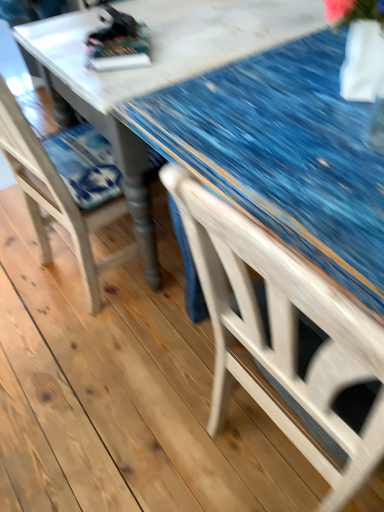
What do you see at coordinates (56, 197) in the screenshot? The height and width of the screenshot is (512, 384). I see `wooden chair at left` at bounding box center [56, 197].

Identify the location of wooden chair at left. (56, 197).

Describe the element at coordinates (283, 153) in the screenshot. The image size is (384, 512). I see `blue fabric-covered table at center` at that location.

The height and width of the screenshot is (512, 384). In order to click on blue fabric-covered table at center in this screenshot , I will do `click(283, 153)`.

In order to click on wooden chair at left in this screenshot , I will do `click(56, 197)`.

Is blue fabric-covered table at center at the left side of wooden chair at left?

Incorrect, blue fabric-covered table at center is not on the left side of wooden chair at left.

Does blue fabric-covered table at center lie in front of wooden chair at left?

No.

Which is closer, (x=254, y=88) or (x=39, y=169)?

Clearly, point (x=254, y=88) is closer to the camera than point (x=39, y=169).

From the image's perspective, between blue fabric-covered table at center and wooden chair at left, which one is located above?

From the image's view, blue fabric-covered table at center is above.

From a real-world perspective, is blue fabric-covered table at center positioned above or below wooden chair at left?

blue fabric-covered table at center is situated lower than wooden chair at left in the real world.

Which of these two, blue fabric-covered table at center or wooden chair at left, is wider?

blue fabric-covered table at center is wider.

Between blue fabric-covered table at center and wooden chair at left, which one has less height?

With less height is blue fabric-covered table at center.

Does blue fabric-covered table at center have a larger size compared to wooden chair at left?

Correct, blue fabric-covered table at center is larger in size than wooden chair at left.

Is blue fabric-covered table at center spatially inside wooden chair at left, or outside of it?

blue fabric-covered table at center is spatially situated outside wooden chair at left.

Does blue fabric-covered table at center touch wooden chair at left?

No, blue fabric-covered table at center is not in contact with wooden chair at left.

Is blue fabric-covered table at center looking in the opposite direction of wooden chair at left?

That's right, blue fabric-covered table at center is facing away from wooden chair at left.

Locate an element on the screen. This screenshot has height=512, width=384. glass table that is under the wooden chair at left (from a real-world perspective) is located at coordinates (283, 153).

Can you confirm if wooden chair at left is positioned to the left of blue fabric-covered table at center?

Correct, you'll find wooden chair at left to the left of blue fabric-covered table at center.

Is wooden chair at left positioned before blue fabric-covered table at center?

Yes, wooden chair at left is closer to the viewer.

Does point (5, 106) appear closer or farther from the camera than point (347, 249)?

Point (5, 106).

From the image's perspective, which is below, wooden chair at left or blue fabric-covered table at center?

wooden chair at left appears lower in the image.

From a real-world perspective, is wooden chair at left physically located above or below blue fabric-covered table at center?

wooden chair at left is above blue fabric-covered table at center.

Considering the relative sizes of wooden chair at left and blue fabric-covered table at center in the image provided, is wooden chair at left wider than blue fabric-covered table at center?

No.

Can you confirm if wooden chair at left is shorter than blue fabric-covered table at center?

No.

Considering the relative sizes of wooden chair at left and blue fabric-covered table at center in the image provided, is wooden chair at left bigger than blue fabric-covered table at center?

Actually, wooden chair at left might be smaller than blue fabric-covered table at center.

Would you say blue fabric-covered table at center is part of wooden chair at left's contents?

No, blue fabric-covered table at center is located outside of wooden chair at left.

Is wooden chair at left far from blue fabric-covered table at center?

That's not correct — wooden chair at left is a little close to blue fabric-covered table at center.

Is wooden chair at left looking in the opposite direction of blue fabric-covered table at center?

Absolutely, wooden chair at left is directed away from blue fabric-covered table at center.

What's the angular difference between wooden chair at left and blue fabric-covered table at center's facing directions?

7.47 degrees.

How far apart are wooden chair at left and blue fabric-covered table at center?

wooden chair at left and blue fabric-covered table at center are 21.04 inches apart.

I want to click on chair in front of the blue fabric-covered table at center, so click(56, 197).

In the image, there is a wooden chair at left. What are the coordinates of `glass table below it (from a real-world perspective)` in the screenshot? It's located at (283, 153).

What are the coordinates of `glass table behind the wooden chair at left` in the screenshot? It's located at (283, 153).